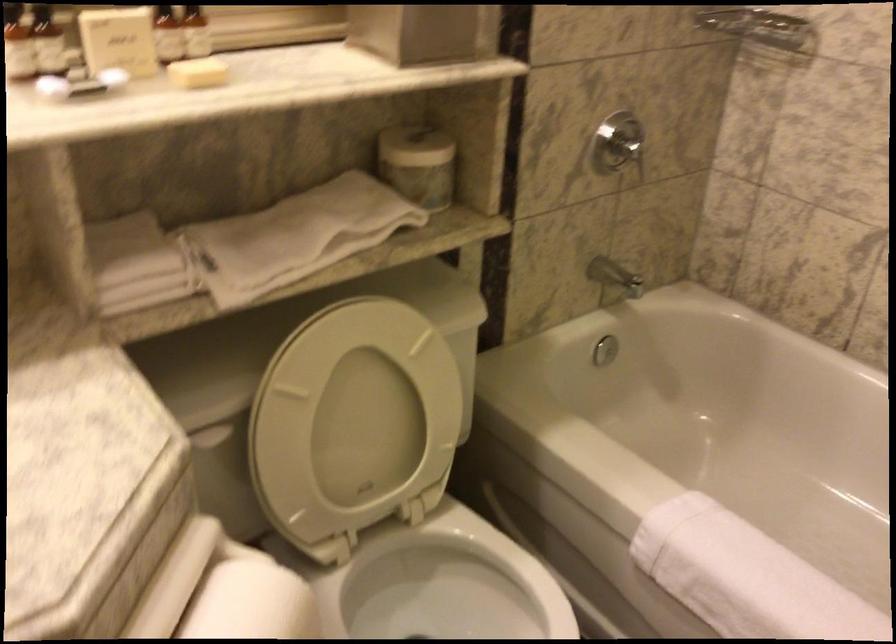
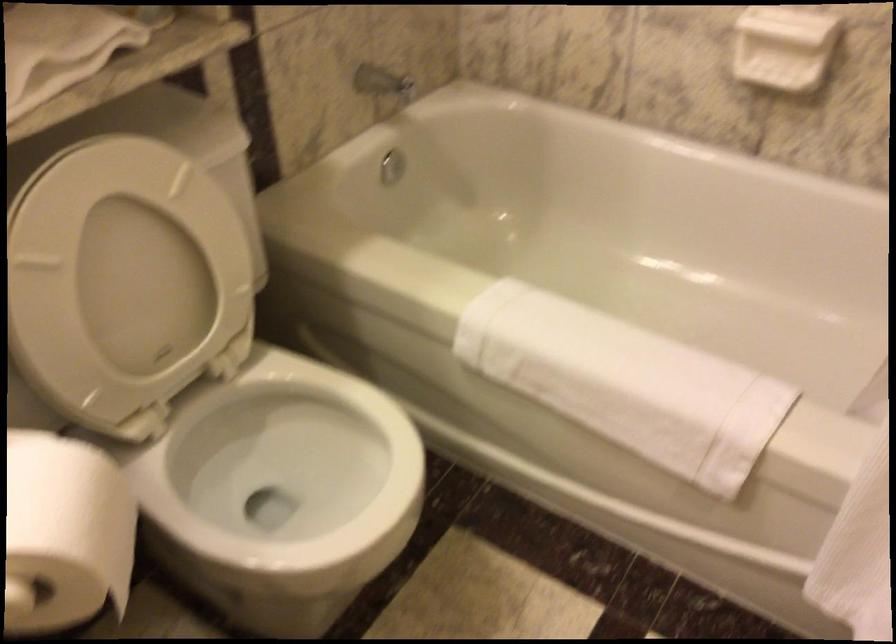
In a continuous first-person perspective shot, in which direction is the camera moving?

The movement direction of the cameraman is right, forward.